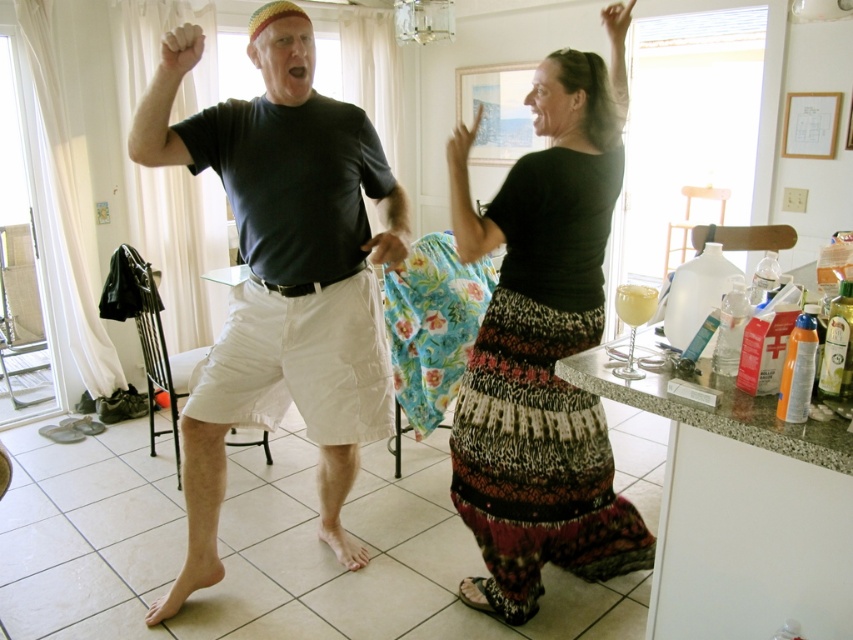
Question: Is matte black t-shirt at center to the left of black textured skirt at center from the viewer's perspective?

Choices:
 (A) yes
 (B) no

Answer: (A)

Question: Which point appears closest to the camera in this image?

Choices:
 (A) (350, 168)
 (B) (515, 401)

Answer: (B)

Question: Is matte black t-shirt at center thinner than black textured skirt at center?

Choices:
 (A) no
 (B) yes

Answer: (A)

Question: Does matte black t-shirt at center have a larger size compared to black textured skirt at center?

Choices:
 (A) yes
 (B) no

Answer: (A)

Question: Which object is farther from the camera taking this photo?

Choices:
 (A) matte black t-shirt at center
 (B) black textured skirt at center

Answer: (B)

Question: Which object is farther from the camera taking this photo?

Choices:
 (A) matte black t-shirt at center
 (B) black textured skirt at center

Answer: (B)